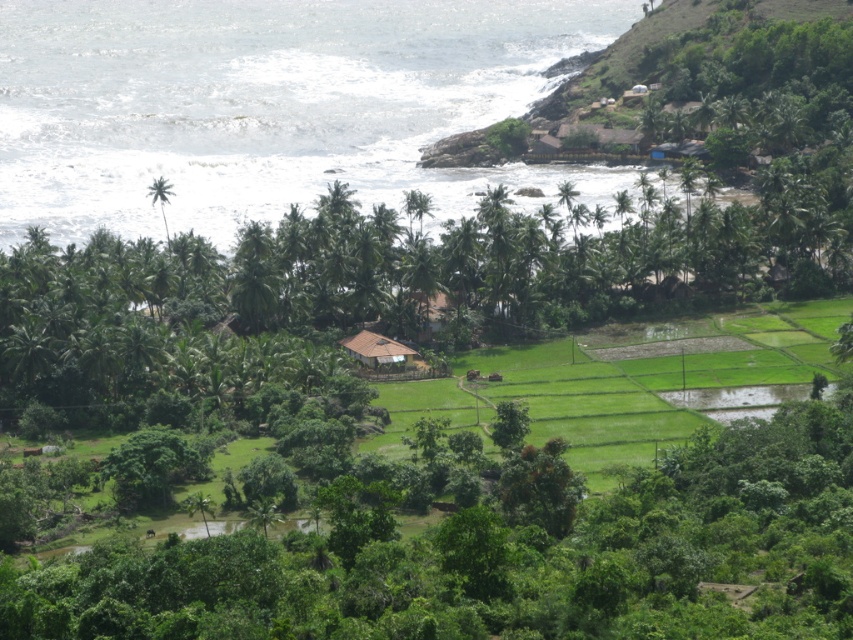
Question: Which is nearer to the brown thatched hut at center?

Choices:
 (A) brown wooden hut at center
 (B) green leafy hillside at upper right
 (C) green leafy palm tree at left

Answer: (A)

Question: Estimate the real-world distances between objects in this image. Which object is closer to the white frothy water at upper left?

Choices:
 (A) brown thatched hut at center
 (B) green leafy hillside at upper right
 (C) green leafy palm tree at left

Answer: (B)

Question: In this image, where is white frothy water at upper left located relative to green leafy palm tree at left?

Choices:
 (A) right
 (B) left

Answer: (B)

Question: Can you confirm if white frothy water at upper left is smaller than green leafy palm tree at left?

Choices:
 (A) yes
 (B) no

Answer: (B)

Question: Can you confirm if green leafy hillside at upper right is positioned above brown thatched hut at center?

Choices:
 (A) no
 (B) yes

Answer: (B)

Question: Which is nearer to the green leafy palm tree at left?

Choices:
 (A) brown wooden hut at center
 (B) white frothy water at upper left
 (C) brown thatched hut at center
 (D) green leafy hillside at upper right

Answer: (A)